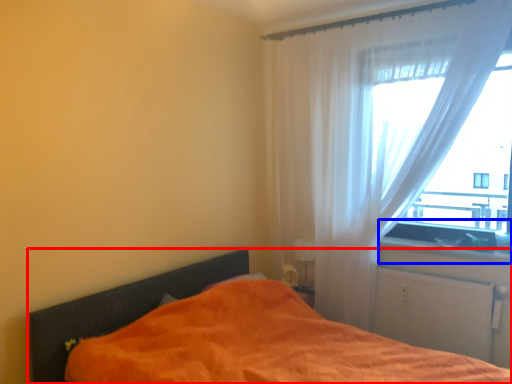
Question: Which object is closer to the camera taking this photo, bed (highlighted by a red box) or window sill (highlighted by a blue box)?

Choices:
 (A) bed
 (B) window sill

Answer: (A)